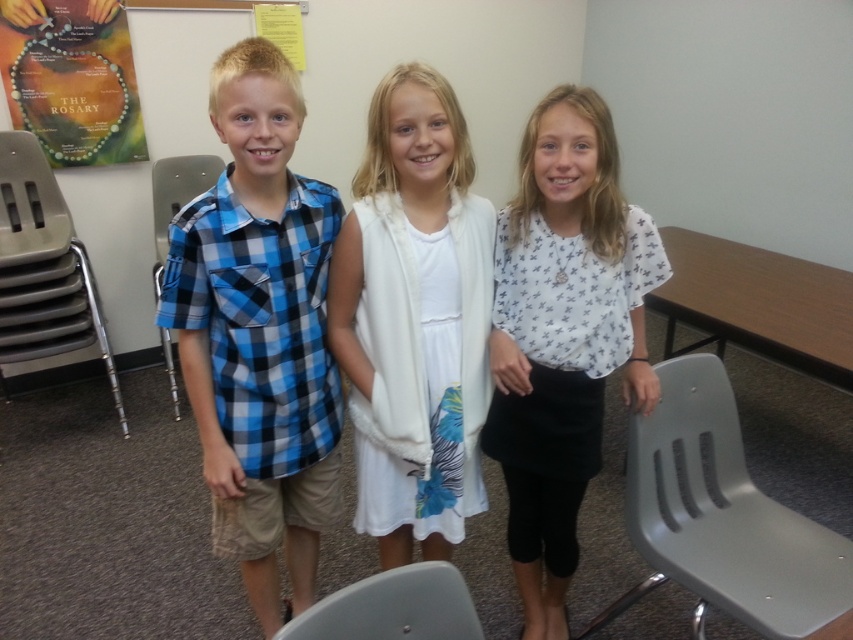
You are a teacher in the classroom and want to move a book from the wooden table at right to the gray plastic chair at lower center. Which direction should you move the book?

The wooden table at right is to the right of the gray plastic chair at lower center, so you should move the book to the left to place it on the gray plastic chair at lower center.

You are a photographer setting up for a group photo. You see the white printed blouse at center and the gray plastic chair at lower center. Which object is positioned more to the right side of the scene?

The white printed blouse at center is positioned more to the right side of the scene compared to the gray plastic chair at lower center.